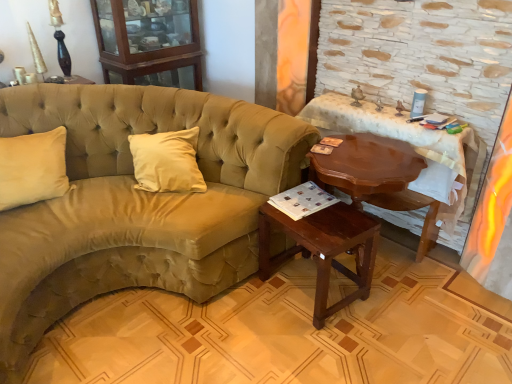
Question: Is mahogany wood table at right, the 2th table from the left, far away from wooden cabinet at upper left?

Choices:
 (A) no
 (B) yes

Answer: (B)

Question: Does mahogany wood table at right, the 2th table from the left, contain wooden cabinet at upper left?

Choices:
 (A) yes
 (B) no

Answer: (B)

Question: Does mahogany wood table at right, which is the 1th table from right to left, lie in front of wooden cabinet at upper left?

Choices:
 (A) yes
 (B) no

Answer: (A)

Question: Is mahogany wood table at right, the 2th table from the left, positioned behind wooden cabinet at upper left?

Choices:
 (A) no
 (B) yes

Answer: (A)

Question: Considering the relative positions of mahogany wood table at right, which is the 1th table from right to left, and wooden cabinet at upper left in the image provided, is mahogany wood table at right, which is the 1th table from right to left, to the right of wooden cabinet at upper left from the viewer's perspective?

Choices:
 (A) no
 (B) yes

Answer: (B)

Question: Is mahogany wood table at right, the 2th table from the left, taller than wooden cabinet at upper left?

Choices:
 (A) no
 (B) yes

Answer: (B)

Question: Does mahogany wood table at right, which is the 1th table from right to left, have a greater width compared to mahogany wood side table at lower center, the first table in the left-to-right sequence?

Choices:
 (A) no
 (B) yes

Answer: (A)

Question: Considering the relative sizes of mahogany wood table at right, the 2th table from the left, and mahogany wood side table at lower center, the first table in the left-to-right sequence, in the image provided, is mahogany wood table at right, the 2th table from the left, smaller than mahogany wood side table at lower center, the first table in the left-to-right sequence,?

Choices:
 (A) no
 (B) yes

Answer: (A)

Question: Would you say mahogany wood side table at lower center, which is counted as the 2th table, starting from the right, is part of mahogany wood table at right, the 2th table from the left,'s contents?

Choices:
 (A) no
 (B) yes

Answer: (A)

Question: Is mahogany wood table at right, which is the 1th table from right to left, outside of mahogany wood side table at lower center, which is counted as the 2th table, starting from the right?

Choices:
 (A) yes
 (B) no

Answer: (A)

Question: From a real-world perspective, is mahogany wood table at right, which is the 1th table from right to left, on top of mahogany wood side table at lower center, the first table in the left-to-right sequence?

Choices:
 (A) yes
 (B) no

Answer: (A)

Question: Does mahogany wood table at right, the 2th table from the left, come behind mahogany wood side table at lower center, the first table in the left-to-right sequence?

Choices:
 (A) yes
 (B) no

Answer: (A)

Question: Is the depth of mahogany wood side table at lower center, which is counted as the 2th table, starting from the right, greater than that of wooden cabinet at upper left?

Choices:
 (A) no
 (B) yes

Answer: (A)